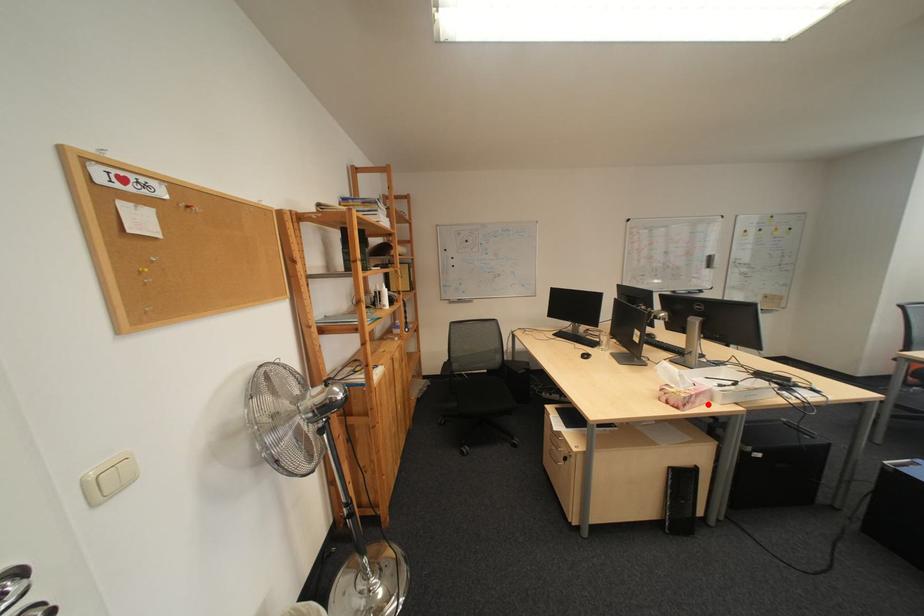
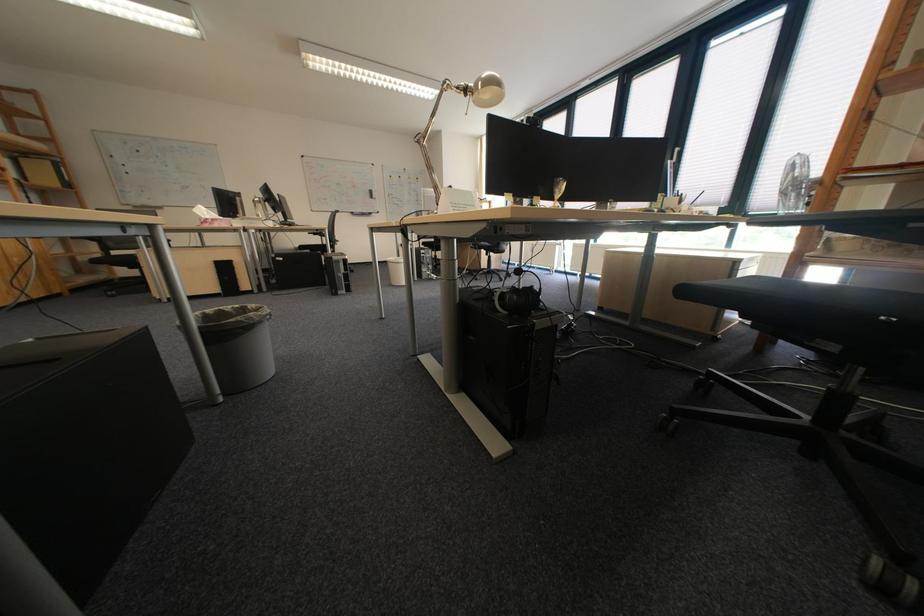
Question: I am providing you with two images of the same scene from different viewpoints. A red point is shown in image1. For the corresponding object point in image2, is it positioned nearer or farther from the camera?

Choices:
 (A) Nearer
 (B) Farther

Answer: (A)